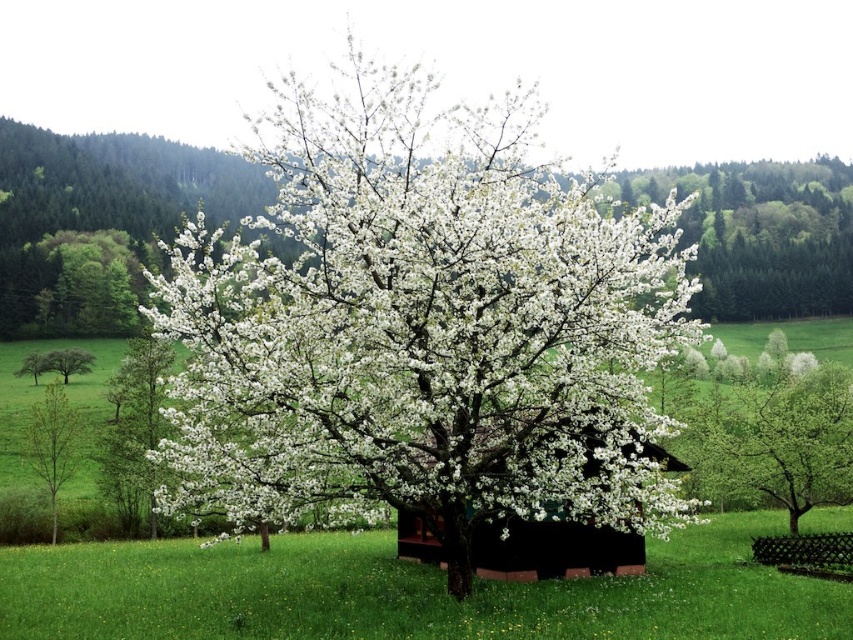
Question: Can you confirm if black wood hut at center is wider than green matte tree at left?

Choices:
 (A) yes
 (B) no

Answer: (A)

Question: Among these points, which one is nearest to the camera?

Choices:
 (A) (196, 445)
 (B) (59, 355)
 (C) (596, 557)
 (D) (38, 467)

Answer: (A)

Question: Which point appears closest to the camera in this image?

Choices:
 (A) (508, 563)
 (B) (32, 460)
 (C) (403, 93)

Answer: (C)

Question: In this image, where is black wood hut at center located relative to green matte tree at left?

Choices:
 (A) above
 (B) below

Answer: (B)

Question: Among these objects, which one is nearest to the camera?

Choices:
 (A) green smooth tree at left
 (B) black wood hut at center
 (C) white matte tree at center

Answer: (C)

Question: Can you confirm if black wood hut at center is thinner than green matte tree at left?

Choices:
 (A) no
 (B) yes

Answer: (A)